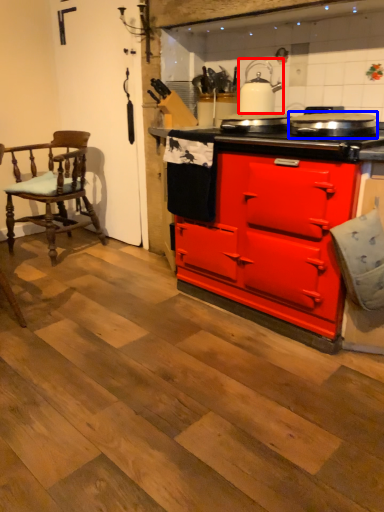
Question: Which point is closer to the camera, kitchen appliance (highlighted by a red box) or appliance (highlighted by a blue box)?

Choices:
 (A) kitchen appliance
 (B) appliance

Answer: (B)